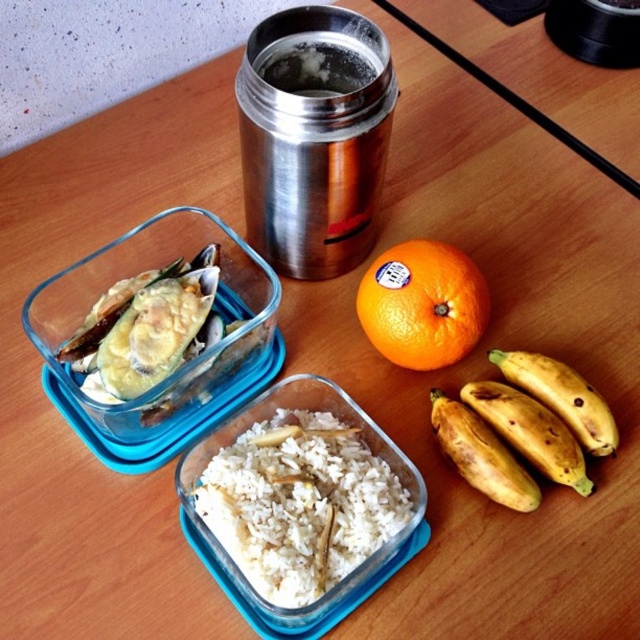
Does point (250, 513) come behind point (540, 404)?

That is False.

Who is positioned more to the right, white matte rice at center or brown spotted bananas at lower right?

brown spotted bananas at lower right

Is point (264, 516) more distant than point (502, 387)?

No, it is in front of (502, 387).

You are a GUI agent. You are given a task and a screenshot of the screen. Output one action in this format:
    pyautogui.click(x=<x>, y=<y>)
    Task: Click on the white matte rice at center
    
    Given the screenshot: What is the action you would take?
    pyautogui.click(x=300, y=506)

Is brown spotted bananas at lower right to the left of yellow matte bananas at lower right from the viewer's perspective?

No, brown spotted bananas at lower right is not to the left of yellow matte bananas at lower right.

Can you confirm if brown spotted bananas at lower right is shorter than yellow matte bananas at lower right?

Indeed, brown spotted bananas at lower right has a lesser height compared to yellow matte bananas at lower right.

Does point (572, 438) come farther from viewer compared to point (476, 422)?

No, it is not.

This screenshot has height=640, width=640. Find the location of `brown spotted bananas at lower right`. brown spotted bananas at lower right is located at coordinates (531, 432).

Is point (512, 413) behind point (579, 387)?

No, it is in front of (579, 387).

Who is higher up, brown spotted bananas at lower right or ripe yellow banana at lower right?

ripe yellow banana at lower right is higher up.

You are a GUI agent. You are given a task and a screenshot of the screen. Output one action in this format:
    pyautogui.click(x=<x>, y=<y>)
    Task: Click on the brown spotted bananas at lower right
    
    Given the screenshot: What is the action you would take?
    pyautogui.click(x=531, y=432)